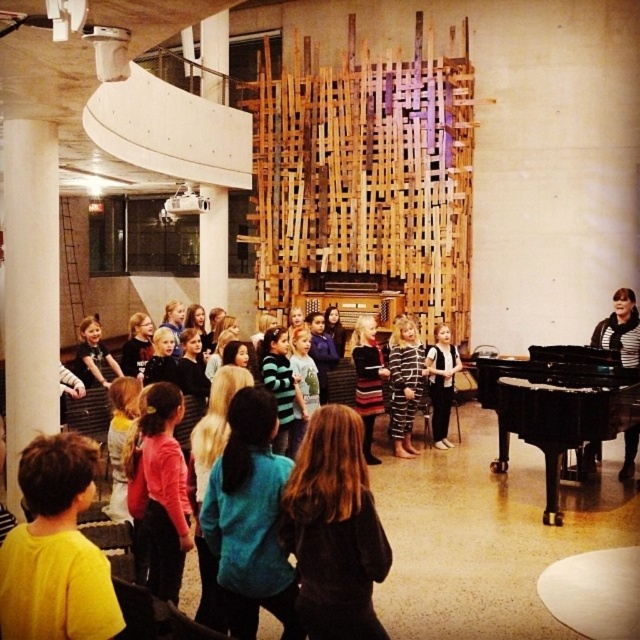
Question: Is the position of black polished piano at right less distant than that of striped fabric dress at center?

Choices:
 (A) yes
 (B) no

Answer: (A)

Question: From the image, what is the correct spatial relationship of pink fabric shirt at center in relation to striped fabric dress at center?

Choices:
 (A) left
 (B) right

Answer: (A)

Question: Which point is closer to the camera?

Choices:
 (A) (147, 410)
 (B) (589, 404)
 (C) (442, 330)

Answer: (A)

Question: Does black polished piano at right appear on the left side of pink fabric shirt at center?

Choices:
 (A) no
 (B) yes

Answer: (A)

Question: Which point is farther to the camera?

Choices:
 (A) (148, 531)
 (B) (449, 410)
 (C) (481, 364)

Answer: (B)

Question: Which point is farther to the camera?

Choices:
 (A) striped fabric dress at center
 (B) black polished piano at right
 (C) pink fabric shirt at center

Answer: (A)